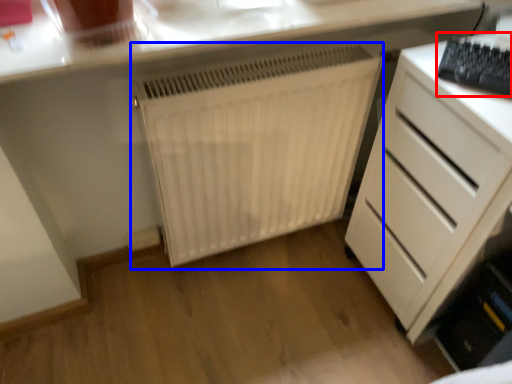
Question: Which point is closer to the camera, keyboard (highlighted by a red box) or radiator (highlighted by a blue box)?

Choices:
 (A) keyboard
 (B) radiator

Answer: (A)